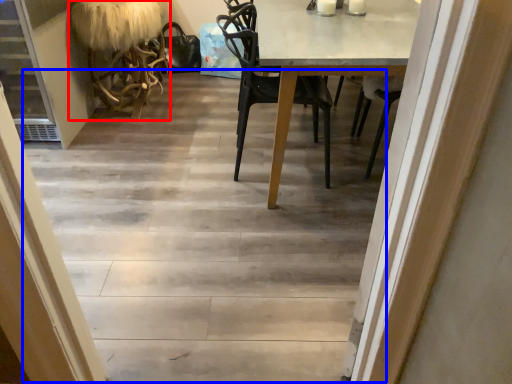
Question: Which of the following is the farthest to the observer, armchair (highlighted by a red box) or stairwell (highlighted by a blue box)?

Choices:
 (A) armchair
 (B) stairwell

Answer: (A)